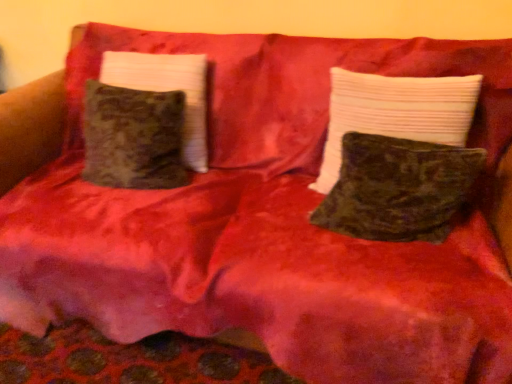
Question: Is velvet green pillow at center, which ranks as the first pillow in right-to-left order, positioned far away from velvety dark green pillow at center, marked as the second pillow in a left-to-right arrangement?

Choices:
 (A) yes
 (B) no

Answer: (B)

Question: Does velvet green pillow at center, which ranks as the first pillow in right-to-left order, have a larger size compared to velvety dark green pillow at center, marked as the second pillow in a left-to-right arrangement?

Choices:
 (A) yes
 (B) no

Answer: (A)

Question: Is velvet green pillow at center, which ranks as the first pillow in right-to-left order, directly adjacent to velvety dark green pillow at center, placed as the second pillow when sorted from right to left?

Choices:
 (A) no
 (B) yes

Answer: (A)

Question: Is velvety dark green pillow at center, marked as the second pillow in a left-to-right arrangement, at the back of velvet green pillow at center, the third pillow viewed from the left?

Choices:
 (A) yes
 (B) no

Answer: (A)

Question: From a real-world perspective, is velvet green pillow at center, which ranks as the first pillow in right-to-left order, on top of velvety dark green pillow at center, placed as the second pillow when sorted from right to left?

Choices:
 (A) no
 (B) yes

Answer: (B)

Question: Does velvet green pillow at center, the third pillow viewed from the left, have a greater height compared to velvety dark green pillow at center, marked as the second pillow in a left-to-right arrangement?

Choices:
 (A) no
 (B) yes

Answer: (B)

Question: Can you confirm if velvet green pillow at left, the third pillow from the right, is shorter than velvet green pillow at center, which ranks as the first pillow in right-to-left order?

Choices:
 (A) yes
 (B) no

Answer: (B)

Question: From the image's perspective, is velvet green pillow at left, the first pillow in the left-to-right sequence, under velvet green pillow at center, the third pillow viewed from the left?

Choices:
 (A) yes
 (B) no

Answer: (B)

Question: Does velvet green pillow at left, the first pillow in the left-to-right sequence, have a larger size compared to velvet green pillow at center, which ranks as the first pillow in right-to-left order?

Choices:
 (A) no
 (B) yes

Answer: (B)

Question: Can you confirm if velvet green pillow at left, the first pillow in the left-to-right sequence, is positioned to the left of velvet green pillow at center, the third pillow viewed from the left?

Choices:
 (A) no
 (B) yes

Answer: (B)

Question: Can you confirm if velvet green pillow at left, the third pillow from the right, is taller than velvet green pillow at center, which ranks as the first pillow in right-to-left order?

Choices:
 (A) no
 (B) yes

Answer: (B)

Question: Is velvet green pillow at left, the first pillow in the left-to-right sequence, oriented away from velvet green pillow at center, which ranks as the first pillow in right-to-left order?

Choices:
 (A) yes
 (B) no

Answer: (B)

Question: Is velvet green pillow at center, the third pillow viewed from the left, oriented away from velvet green pillow at left, the third pillow from the right?

Choices:
 (A) no
 (B) yes

Answer: (A)